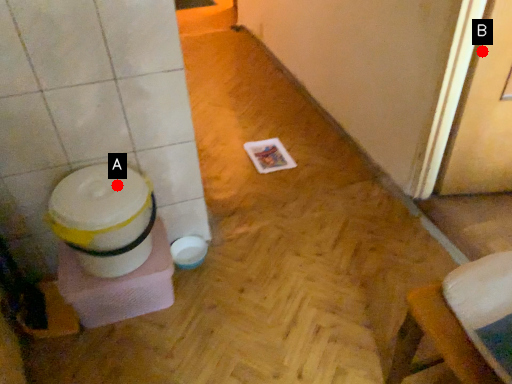
Question: Two points are circled on the image, labeled by A and B beside each circle. Which of the following is the farthest from the observer?

Choices:
 (A) A is further
 (B) B is further

Answer: (B)